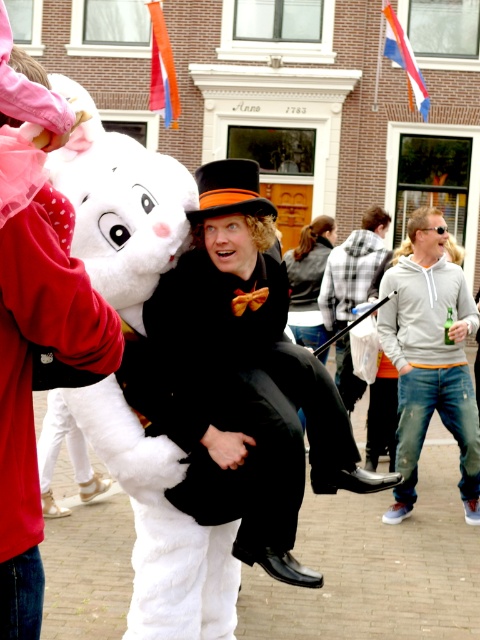
Does matte black jacket at center appear over orange felt dress hat at center?

Correct, matte black jacket at center is located above orange felt dress hat at center.

Is point (316, 244) behind point (249, 173)?

Yes, it is behind point (249, 173).

Does point (297, 266) lie in front of point (255, 202)?

No, it is not.

You are a GUI agent. You are given a task and a screenshot of the screen. Output one action in this format:
    pyautogui.click(x=<x>, y=<y>)
    Task: Click on the matte black jacket at center
    This screenshot has height=640, width=480.
    Given the screenshot: What is the action you would take?
    pyautogui.click(x=309, y=280)

The image size is (480, 640). What do you see at coordinates (430, 358) in the screenshot?
I see `denim jeans at right` at bounding box center [430, 358].

Which is behind, point (456, 412) or point (255, 177)?

The point (456, 412) is more distant.

At what (x,y) coordinates should I click in order to perform the action: click on denim jeans at right. Please return your answer as a coordinate pair (x, y). Image resolution: width=480 pixels, height=640 pixels. Looking at the image, I should click on click(x=430, y=358).

Where is `denim jeans at right`? denim jeans at right is located at coordinates (430, 358).

Between black leather jacket at center and orange felt dress hat at center, which one has more height?

Standing taller between the two is black leather jacket at center.

Does black leather jacket at center have a lesser height compared to orange felt dress hat at center?

Incorrect, black leather jacket at center's height does not fall short of orange felt dress hat at center's.

Image resolution: width=480 pixels, height=640 pixels. What are the coordinates of `black leather jacket at center` in the screenshot? It's located at (352, 269).